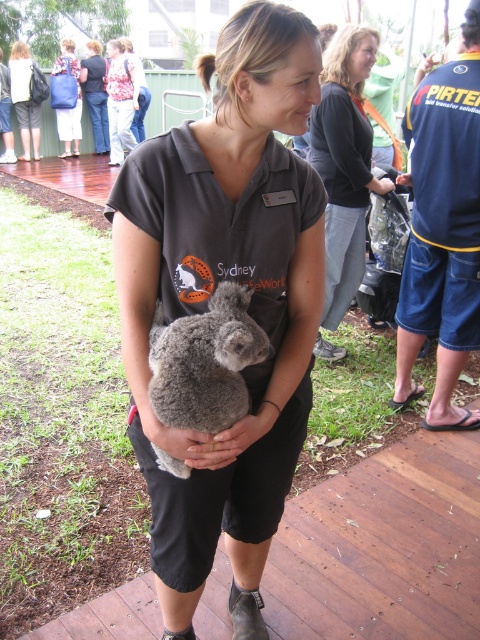
Is fuzzy gray koala at center shorter than matte black shirt at center?

Indeed, fuzzy gray koala at center has a lesser height compared to matte black shirt at center.

Can you confirm if fuzzy gray koala at center is wider than matte black shirt at center?

No, fuzzy gray koala at center is not wider than matte black shirt at center.

Where is `fuzzy gray koala at center`? The width and height of the screenshot is (480, 640). fuzzy gray koala at center is located at coordinates (205, 362).

Where is `fuzzy gray koala at center`? fuzzy gray koala at center is located at coordinates (205, 362).

Can you confirm if dark gray fleece shirt at center is shorter than dark gray sweater at upper center?

Yes.

Which is more to the left, dark gray fleece shirt at center or dark gray sweater at upper center?

From the viewer's perspective, dark gray fleece shirt at center appears more on the left side.

Between point (121, 305) and point (338, 164), which one is positioned behind?

Positioned behind is point (338, 164).

The width and height of the screenshot is (480, 640). Identify the location of dark gray fleece shirt at center. (213, 289).

Can you confirm if dark gray fleece shirt at center is taller than fuzzy gray koala at center?

Yes, dark gray fleece shirt at center is taller than fuzzy gray koala at center.

Between point (240, 220) and point (252, 289), which one is positioned behind?

Point (252, 289)

Is point (241, 170) positioned after point (230, 364)?

Yes.

This screenshot has height=640, width=480. Find the location of `dark gray fleece shirt at center`. dark gray fleece shirt at center is located at coordinates (213, 289).